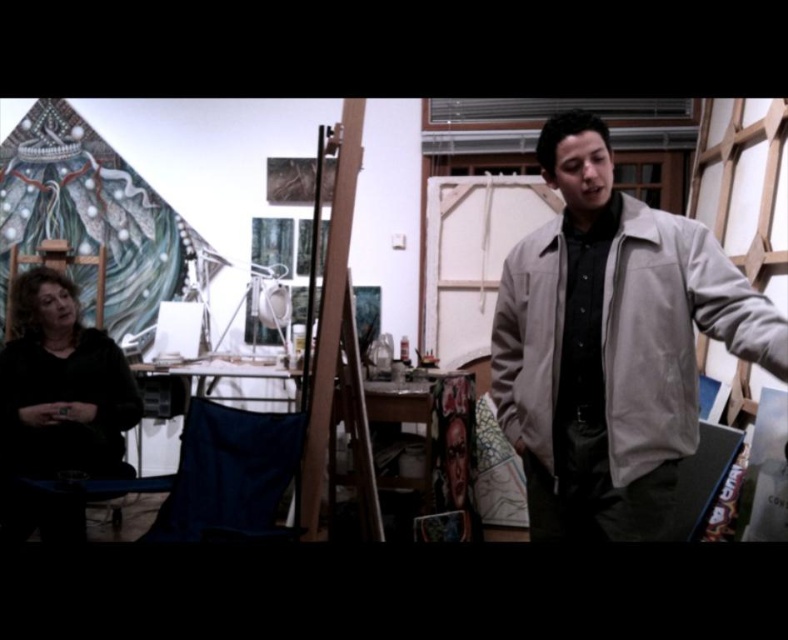
You are standing in the art studio and want to move from the point at coordinates point [82,342] to the point at coordinates point [316,468]. Will you have to walk forward or backward to reach your destination?

Since point [82,342] is behind point [316,468], you will need to walk forward to reach point [316,468] from point [82,342].

You are an artist in the studio and need to retrieve your tools from the table near the seated person. To do so, you must walk around the man in the light beige jacket at center. Which direction should you go to avoid bumping into him, considering his position relative to the black matte shirt at lower left?

Since the light beige jacket at center is to the right of the black matte shirt at lower left, you should go to the left of the light beige jacket at center to avoid bumping into him.

In the art studio scene, there is a man in a light gray jacket and a person in a black matte shirt. Where is the black matte shirt at lower left located in terms of coordinates?

The black matte shirt at lower left is located at coordinates point [58,392].